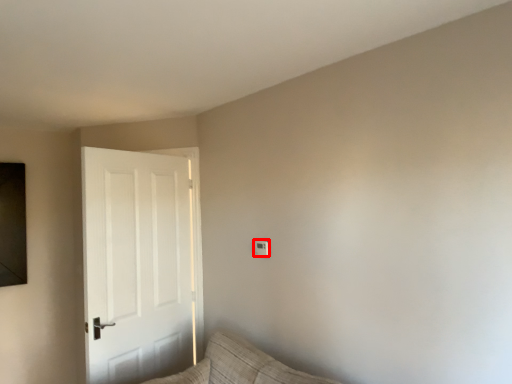
Question: In this image, where is light switch (annotated by the red box) located relative to door?

Choices:
 (A) right
 (B) left

Answer: (A)